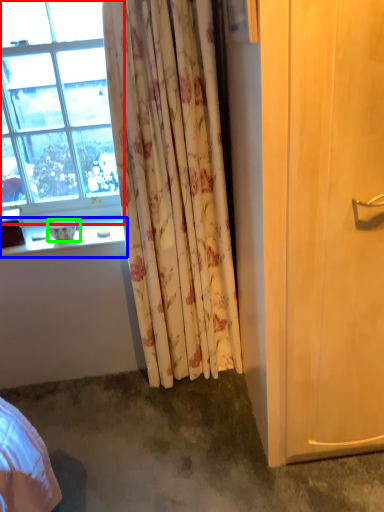
Question: Which object is the farthest from window (highlighted by a red box)? Choose among these: window sill (highlighted by a blue box) or bowl (highlighted by a green box).

Choices:
 (A) window sill
 (B) bowl

Answer: (B)